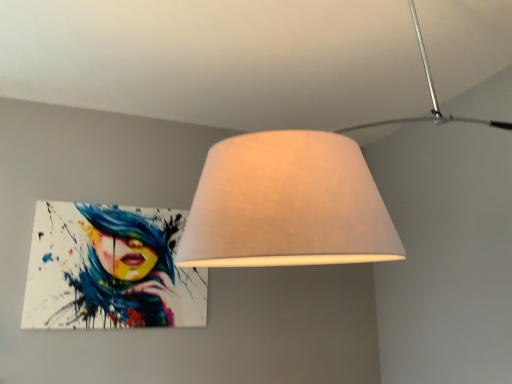
This screenshot has height=384, width=512. What do you see at coordinates (296, 197) in the screenshot?
I see `matte white lampshade at upper center` at bounding box center [296, 197].

What are the coordinates of `matte white lampshade at upper center` in the screenshot? It's located at (296, 197).

This screenshot has height=384, width=512. Find the location of `matte white lampshade at upper center`. matte white lampshade at upper center is located at coordinates (296, 197).